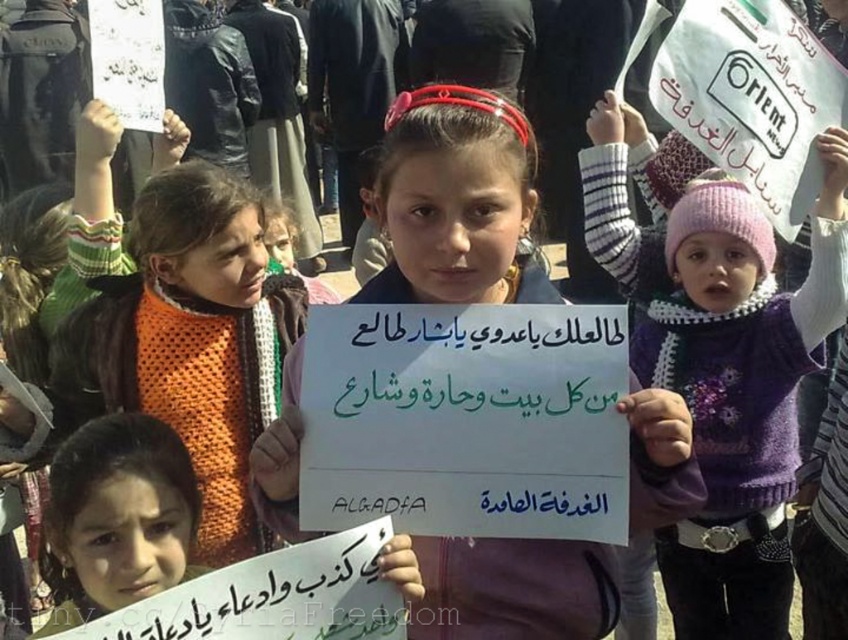
Question: Which object appears closest to the camera in this image?

Choices:
 (A) white paper sign at center
 (B) purple knitted sweater at center
 (C) orange knitted sweater at upper left

Answer: (A)

Question: Among these points, which one is nearest to the camera?

Choices:
 (A) (473, 634)
 (B) (685, 378)

Answer: (A)

Question: Which object is closer to the camera taking this photo?

Choices:
 (A) orange knitted sweater at upper left
 (B) purple knitted sweater at center
 (C) white paper sign at center

Answer: (C)

Question: Is purple knitted sweater at center wider than orange knitted sweater at upper left?

Choices:
 (A) no
 (B) yes

Answer: (A)

Question: Does purple knitted sweater at center appear over white paper sign at center?

Choices:
 (A) yes
 (B) no

Answer: (B)

Question: Is white paper sign at center behind orange knitted sweater at upper left?

Choices:
 (A) no
 (B) yes

Answer: (A)